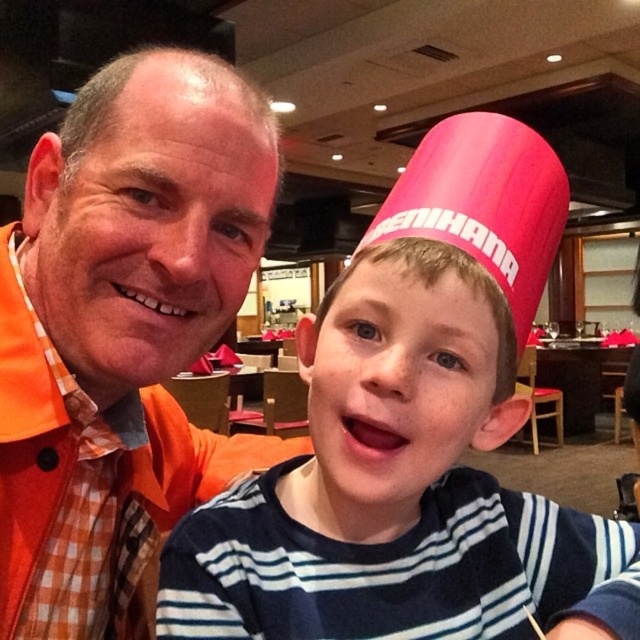
Is pink fabric hat at upper right thinner than orange checkered shirt at left?

No.

Between point (403, 618) and point (246, 268), which one is positioned in front?

Point (403, 618) is in front.

Where is `pink fabric hat at upper right`? Image resolution: width=640 pixels, height=640 pixels. pink fabric hat at upper right is located at coordinates (397, 499).